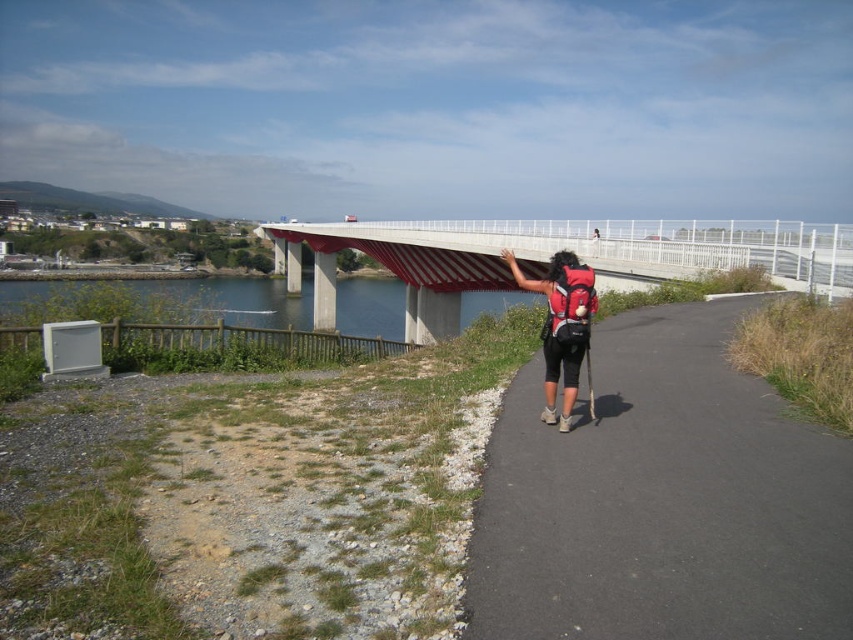
You are a hiker planning to cross the concrete bridge at center. You see the black asphalt path at center leading towards it. Is the path going under or over the bridge?

The black asphalt path at center is below the concrete bridge at center, so the path goes under the bridge.